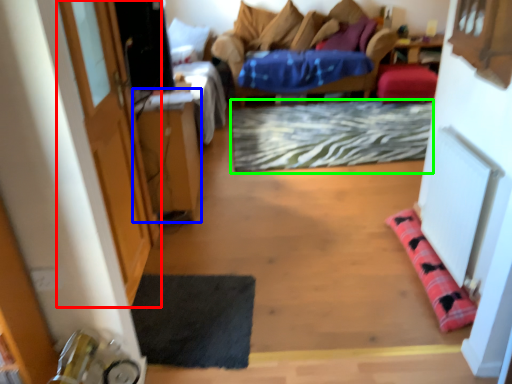
Question: Considering the real-world distances, which object is farthest from door (highlighted by a red box)? table (highlighted by a blue box) or doormat (highlighted by a green box)?

Choices:
 (A) table
 (B) doormat

Answer: (B)